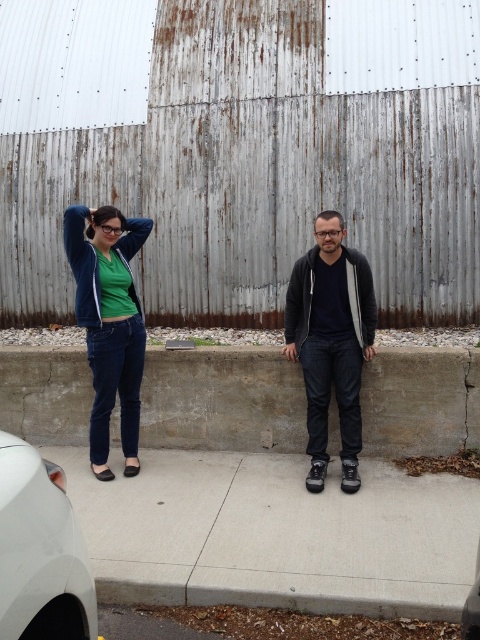
Question: Which object appears farthest from the camera in this image?

Choices:
 (A) dark gray hoodie at center
 (B) gray concrete pavement at center
 (C) concrete at center
 (D) matte blue jacket at left

Answer: (C)

Question: Is matte blue jeans at left bigger than matte blue jacket at left?

Choices:
 (A) yes
 (B) no

Answer: (B)

Question: Is matte blue jeans at left to the right of matte blue jacket at left from the viewer's perspective?

Choices:
 (A) yes
 (B) no

Answer: (A)

Question: Which point appears closest to the camera in this image?

Choices:
 (A) (108, 397)
 (B) (121, 296)
 (C) (292, 292)
 (D) (1, 497)

Answer: (D)

Question: Estimate the real-world distances between objects in this image. Which object is closer to the concrete at center?

Choices:
 (A) matte blue jacket at left
 (B) matte blue jeans at left
 (C) gray concrete pavement at center
 (D) white matte car at lower left

Answer: (B)

Question: From the image, what is the correct spatial relationship of matte blue jeans at left in relation to matte blue jacket at left?

Choices:
 (A) left
 (B) right

Answer: (B)